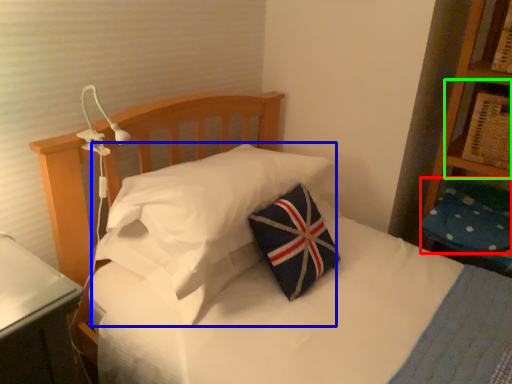
Question: Which is nearer to the pillow (highlighted by a red box)? pillow (highlighted by a blue box) or shelf (highlighted by a green box).

Choices:
 (A) pillow
 (B) shelf

Answer: (B)